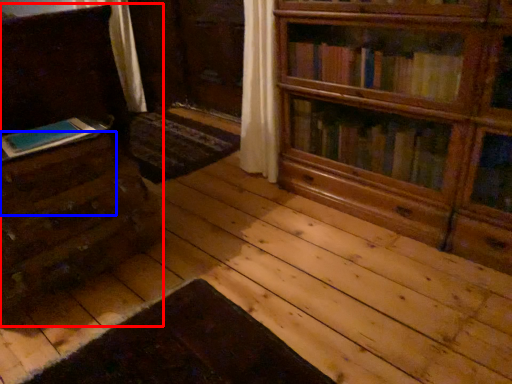
Question: Which object appears closest to the camera in this image, chest of drawers (highlighted by a red box) or drawer (highlighted by a blue box)?

Choices:
 (A) chest of drawers
 (B) drawer

Answer: (B)